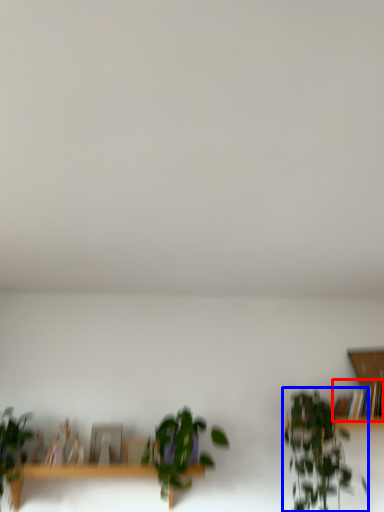
Question: Which of the following is the closest to the observer, book (highlighted by a red box) or houseplant (highlighted by a blue box)?

Choices:
 (A) book
 (B) houseplant

Answer: (B)